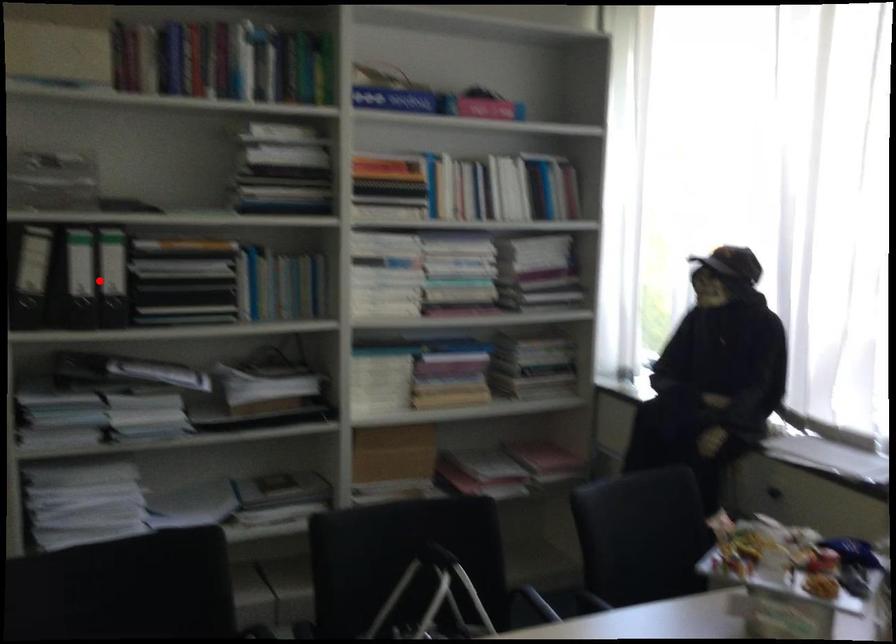
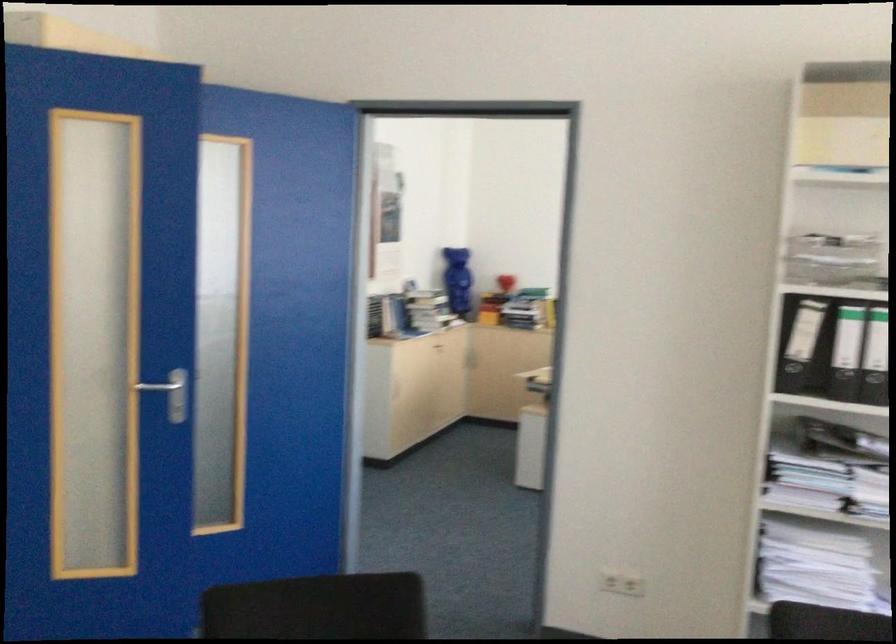
In the second image, find the point that corresponds to the highlighted location in the first image.

(858, 355)